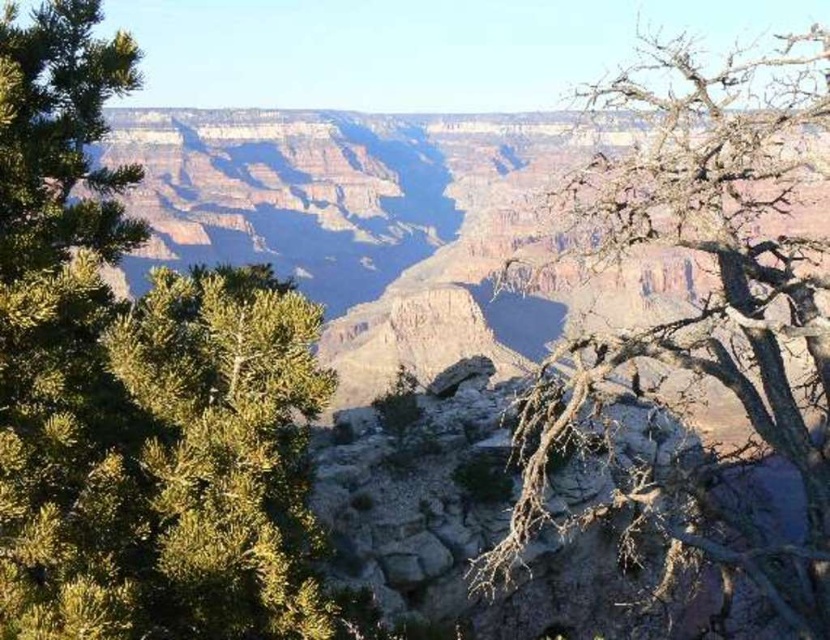
In the scene shown: You are a photographer planning to capture a wide shot of the Grand Canyon. You notice the green leafy tree at left and the bare branches at right in your frame. Considering their widths, which object would require more space in the foreground to avoid cropping?

The bare branches at right require more space in the foreground because they have a greater width compared to the green leafy tree at left.

You are standing at the edge of the Grand Canyon and see two points marked on the canyon wall. The first point is at coordinates point (257,360), and the second is at point (711,321). Which point is closer to you?

Point (257,360) is closer to the viewer than point (711,321).